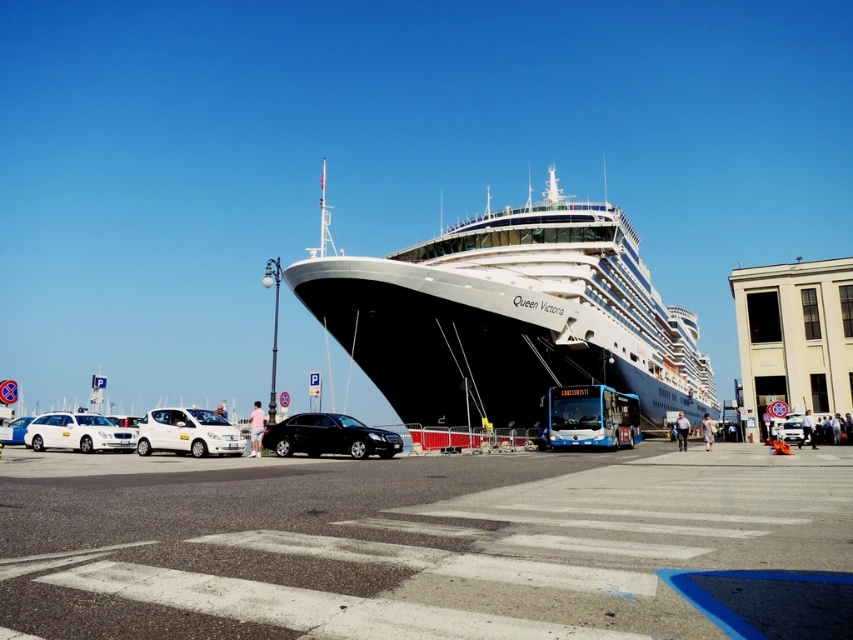
You are a port authority official planning to place a new security checkpoint. The white glossy cruise ship at center is located at coordinates 0.494, 0.598. Where should you place the checkpoint to ensure it is closest to the ship?

The checkpoint should be placed near the coordinates (509,316) to be closest to the white glossy cruise ship at center.

You are standing at the entrance of the port and want to find the black asphalt parking lot at center. According to the scene description, where should you look relative to the Queen Victoria cruise ship?

The black asphalt parking lot at center is located at point (424, 545), which is near the center of the image. Since the Queen Victoria cruise ship is docked at the port and the parking lot is at the center, you should look towards the middle area of the port near the ship to find it.